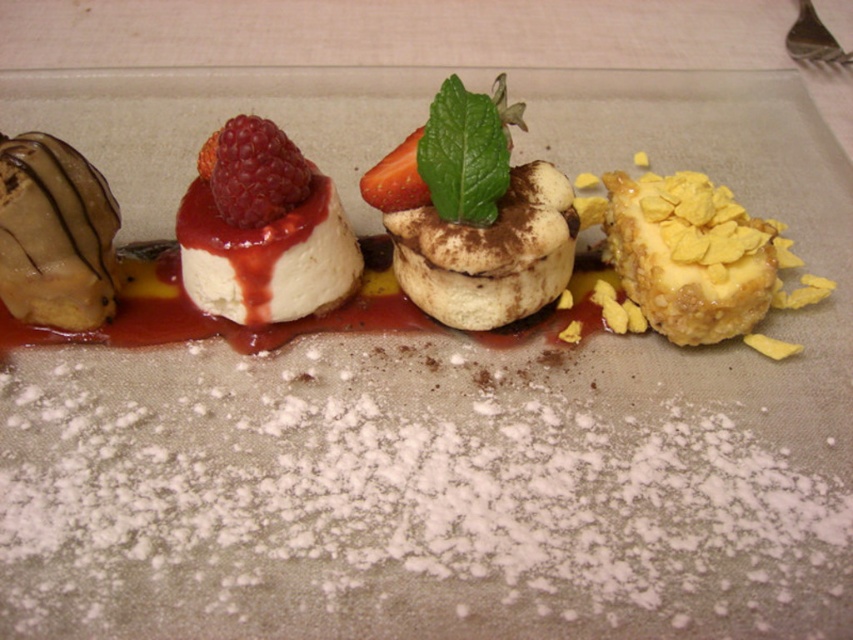
You are arranging desserts on a plate and see the white creamy mousse at center and strawberry at center. Which dessert is positioned to the left?

The white creamy mousse at center is positioned to the left of the strawberry at center.

You are a dessert artist arranging desserts on a plate. You have a white creamy mousse at center. Where should you place it to ensure it aligns with the existing desserts on the plate?

The white creamy mousse at center should be placed at point (262, 228) to align with the existing desserts on the plate.